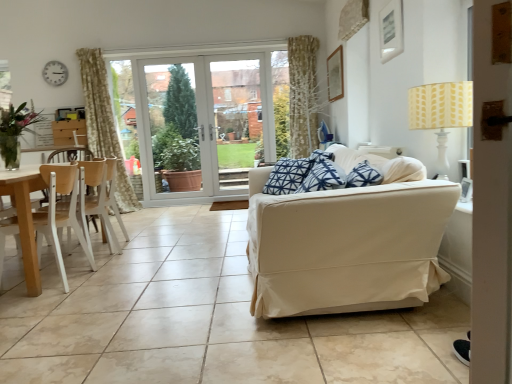
Identify the location of vacant space to the right of wooden chair at left, the 2th chair from the front. (142, 246).